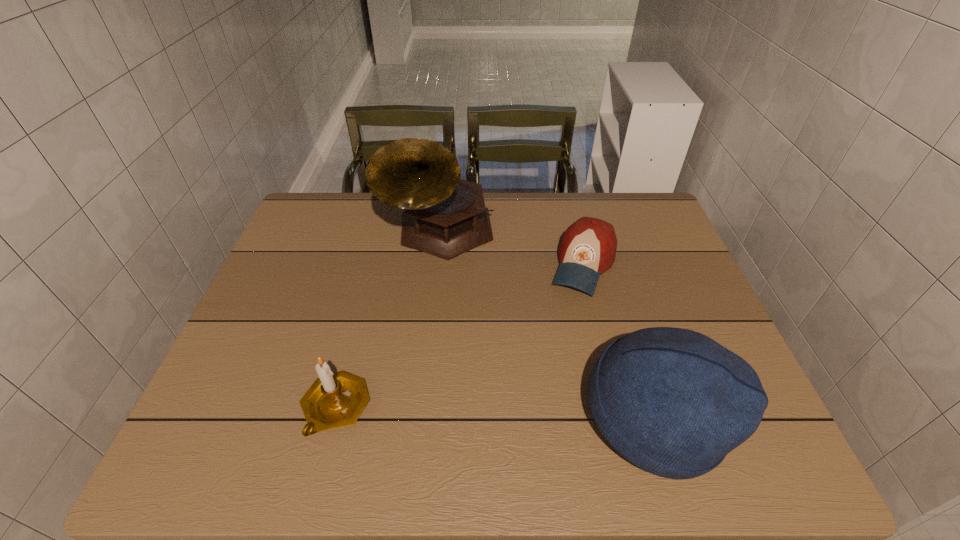
Find the location of a particular element. The image size is (960, 540). vacant space on the desktop that is between the candle holder and the skullcap and is positioned on the front-facing side of the baseball cap is located at coordinates (524, 413).

Image resolution: width=960 pixels, height=540 pixels. Identify the location of free space on the desktop that is between the candle holder and the skullcap and is positioned on the horn direction of the phonograph record. (447, 411).